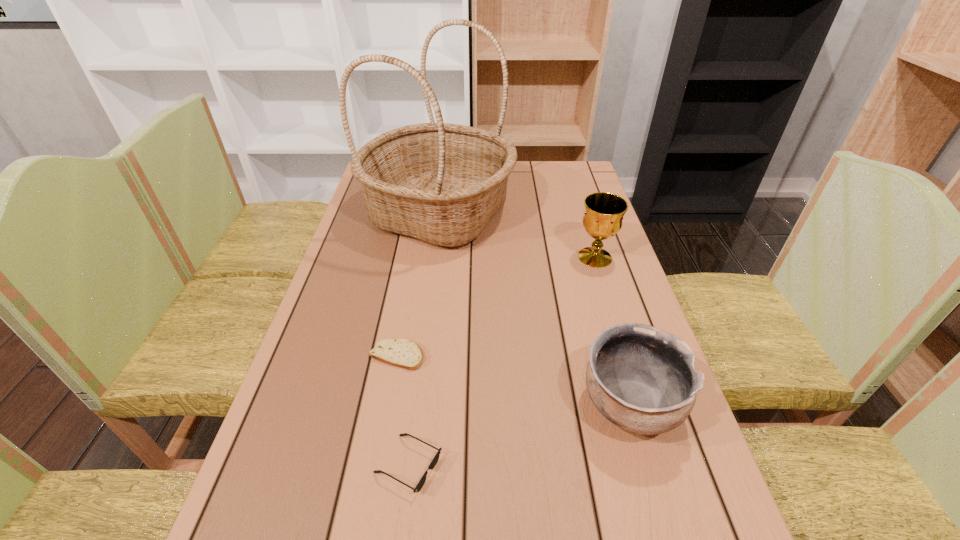
Where is `object that is positioned at the far edge`? The image size is (960, 540). object that is positioned at the far edge is located at coordinates (441, 183).

Find the location of a particular element. basket that is at the left edge is located at coordinates (441, 183).

You are a GUI agent. You are given a task and a screenshot of the screen. Output one action in this format:
    pyautogui.click(x=<x>, y=<y>)
    Task: Click on the pita bread present at the left edge
    
    Given the screenshot: What is the action you would take?
    pyautogui.click(x=403, y=353)

Identify the location of chalice present at the right edge. This screenshot has width=960, height=540. (603, 217).

Find the location of a particular element. pottery located at the right edge is located at coordinates (641, 378).

I want to click on object at the far left corner, so click(x=441, y=183).

At what (x,y) coordinates should I click in order to perform the action: click on vacant space at the right edge of the desktop. Please return your answer as a coordinate pair (x, y). Image resolution: width=960 pixels, height=540 pixels. Looking at the image, I should click on (625, 494).

Image resolution: width=960 pixels, height=540 pixels. Identify the location of vacant area that lies between the chalice and the tallest object. coord(517,235).

At what (x,y) coordinates should I click in order to perform the action: click on free space between the tallest object and the pita bread. Please return your answer as a coordinate pair (x, y). Looking at the image, I should click on (419, 284).

You are a GUI agent. You are given a task and a screenshot of the screen. Output one action in this format:
    pyautogui.click(x=<x>, y=<y>)
    Task: Click on the vacant region between the pottery and the pita bread
    Image resolution: width=960 pixels, height=540 pixels.
    Given the screenshot: What is the action you would take?
    pyautogui.click(x=514, y=380)